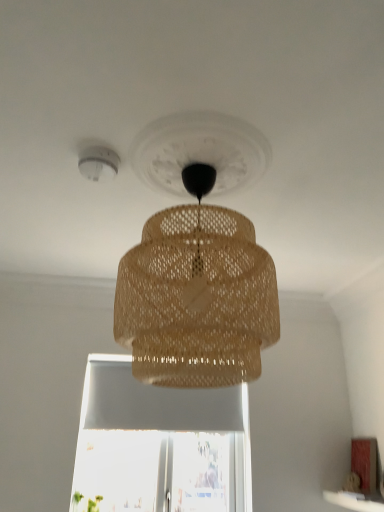
Question: In the image, is brown woven lampshade at center on the left side or the right side of white plastic smoke detector at upper left?

Choices:
 (A) left
 (B) right

Answer: (B)

Question: Is brown woven lampshade at center bigger or smaller than white plastic smoke detector at upper left?

Choices:
 (A) big
 (B) small

Answer: (A)

Question: Which object is positioned farthest from the white plastic smoke detector at upper left?

Choices:
 (A) white matte window sill at lower right
 (B) brown woven lampshade at center

Answer: (A)

Question: Which object is positioned closest to the white plastic smoke detector at upper left?

Choices:
 (A) white matte window sill at lower right
 (B) brown woven lampshade at center

Answer: (B)